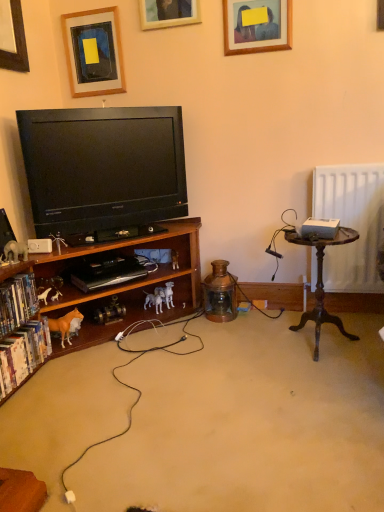
The width and height of the screenshot is (384, 512). I want to click on vacant space that's between woodenmaterial/texture bookcase at left and copper glass lantern at center, acting as the 4th toy starting from the left, so click(202, 362).